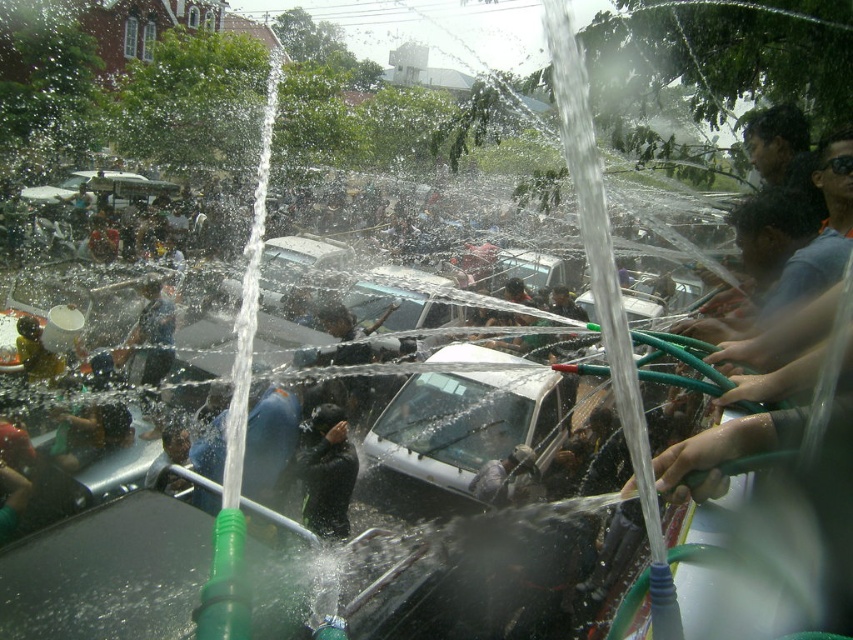
Looking at this image, can you confirm if black matte clothing at center is bigger than dark blue fabric shirt at center?

Incorrect, black matte clothing at center is not larger than dark blue fabric shirt at center.

Is point (325, 493) less distant than point (152, 364)?

Yes, point (325, 493) is in front of point (152, 364).

Identify the location of black matte clothing at center. (326, 472).

Describe the element at coordinates (469, 417) in the screenshot. I see `white matte car at center` at that location.

Can you confirm if white matte car at center is positioned to the left of black matte clothing at center?

Incorrect, white matte car at center is not on the left side of black matte clothing at center.

At what (x,y) coordinates should I click in order to perform the action: click on white matte car at center. Please return your answer as a coordinate pair (x, y). Looking at the image, I should click on (469, 417).

Locate an element on the screen. The width and height of the screenshot is (853, 640). white matte car at center is located at coordinates (469, 417).

Which is below, white matte car at center or dark blue fabric shirt at center?

Positioned lower is white matte car at center.

Is white matte car at center positioned in front of dark blue fabric shirt at center?

That is True.

You are a GUI agent. You are given a task and a screenshot of the screen. Output one action in this format:
    pyautogui.click(x=<x>, y=<y>)
    Task: Click on the white matte car at center
    This screenshot has width=853, height=640.
    Given the screenshot: What is the action you would take?
    pyautogui.click(x=469, y=417)